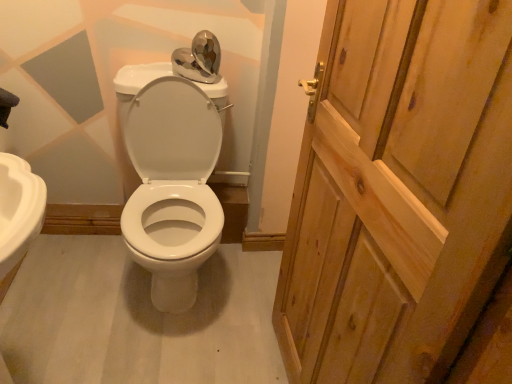
Question: Can you confirm if white glossy toilet at center is thinner than wooden door at right?

Choices:
 (A) yes
 (B) no

Answer: (B)

Question: Does white glossy toilet at center have a lesser height compared to wooden door at right?

Choices:
 (A) no
 (B) yes

Answer: (B)

Question: Can you confirm if white glossy toilet at center is smaller than wooden door at right?

Choices:
 (A) no
 (B) yes

Answer: (A)

Question: Is wooden door at right at the back of white glossy toilet at center?

Choices:
 (A) no
 (B) yes

Answer: (A)

Question: Considering the relative sizes of white glossy toilet at center and wooden door at right in the image provided, is white glossy toilet at center taller than wooden door at right?

Choices:
 (A) yes
 (B) no

Answer: (B)

Question: From a real-world perspective, is white glossy toilet at center beneath wooden door at right?

Choices:
 (A) no
 (B) yes

Answer: (B)

Question: Does wooden door at right come in front of white glossy toilet at center?

Choices:
 (A) yes
 (B) no

Answer: (A)

Question: Does wooden door at right appear on the right side of white glossy toilet at center?

Choices:
 (A) yes
 (B) no

Answer: (A)

Question: Is wooden door at right outside white glossy toilet at center?

Choices:
 (A) no
 (B) yes

Answer: (B)

Question: From a real-world perspective, is wooden door at right below white glossy toilet at center?

Choices:
 (A) no
 (B) yes

Answer: (A)

Question: From a real-world perspective, is wooden door at right over white glossy toilet at center?

Choices:
 (A) yes
 (B) no

Answer: (A)

Question: Would you consider wooden door at right to be distant from white glossy toilet at center?

Choices:
 (A) no
 (B) yes

Answer: (A)

Question: From their relative heights in the image, would you say white glossy toilet at center is taller or shorter than wooden door at right?

Choices:
 (A) short
 (B) tall

Answer: (A)